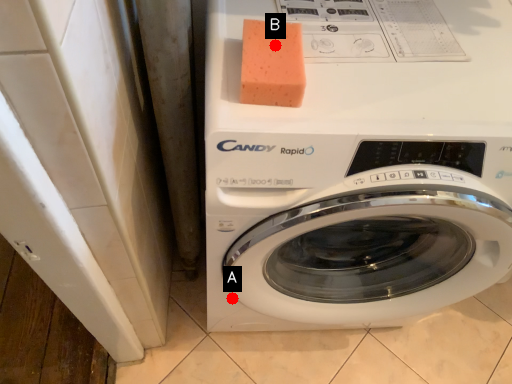
Question: Two points are circled on the image, labeled by A and B beside each circle. Which point is farther to the camera?

Choices:
 (A) A is further
 (B) B is further

Answer: (A)